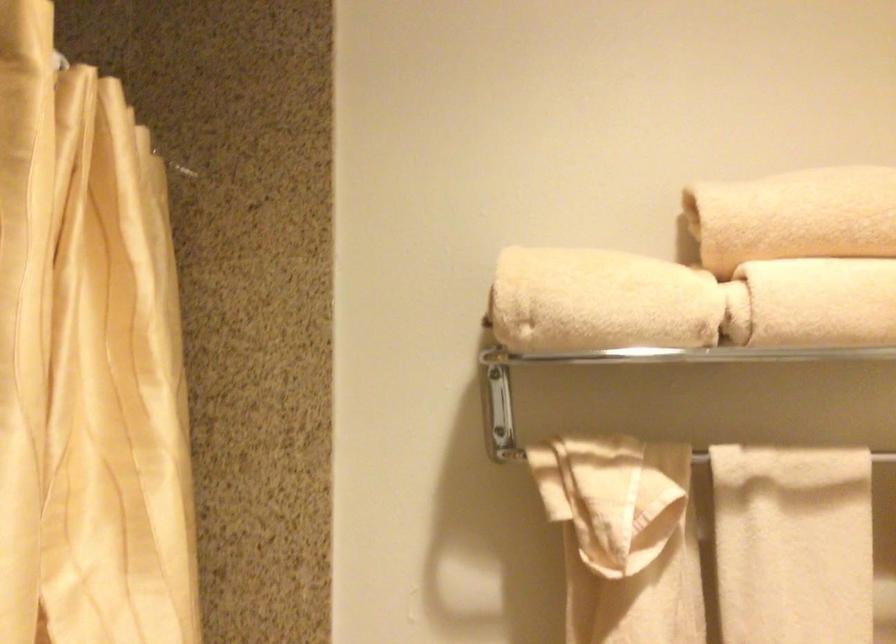
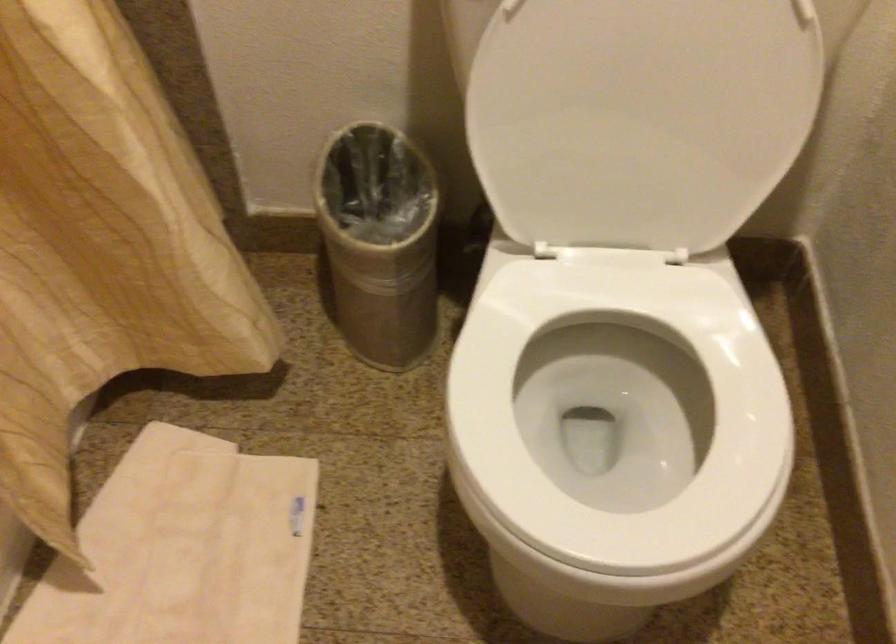
Question: The first image is from the beginning of the video and the second image is from the end. How did the camera likely rotate when shooting the video?

Choices:
 (A) Left
 (B) Right
 (C) Up
 (D) Down

Answer: (D)